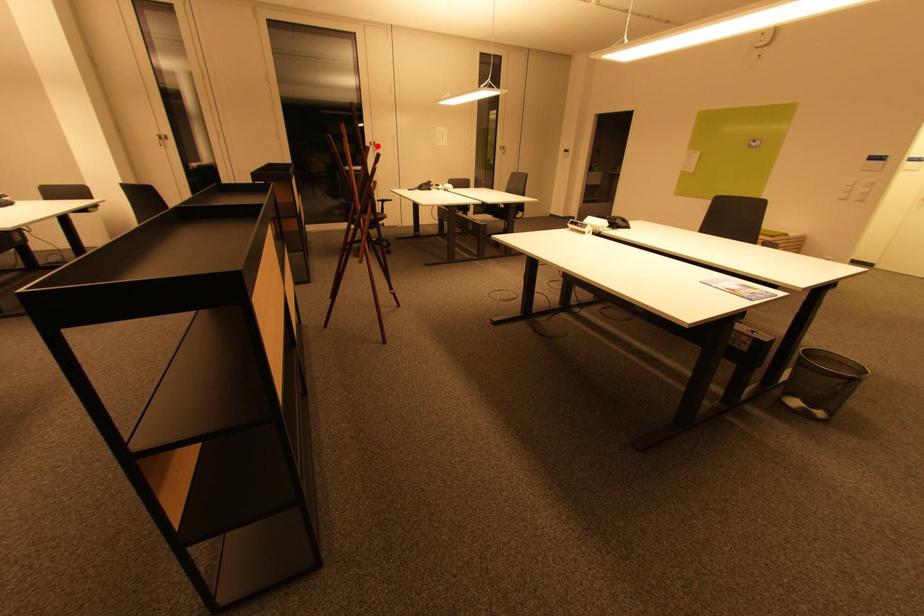
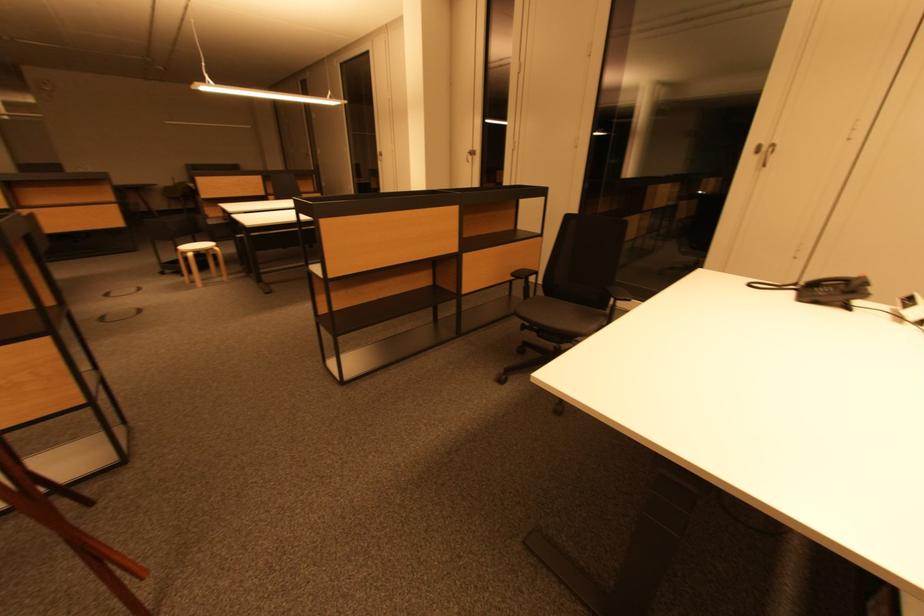
Question: I am providing you with two images of the same scene from different viewpoints. A red point is shown in image1. For the corresponding object point in image2, is it positioned nearer or farther from the camera?

Choices:
 (A) Nearer
 (B) Farther

Answer: (B)